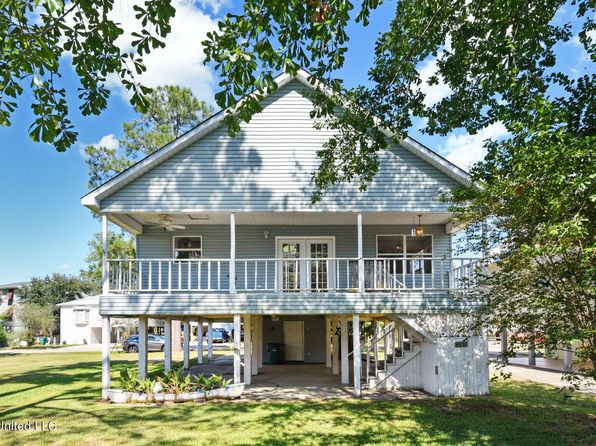
Where is `plant holders`? plant holders is located at coordinates (134, 386), (169, 387), (197, 384).